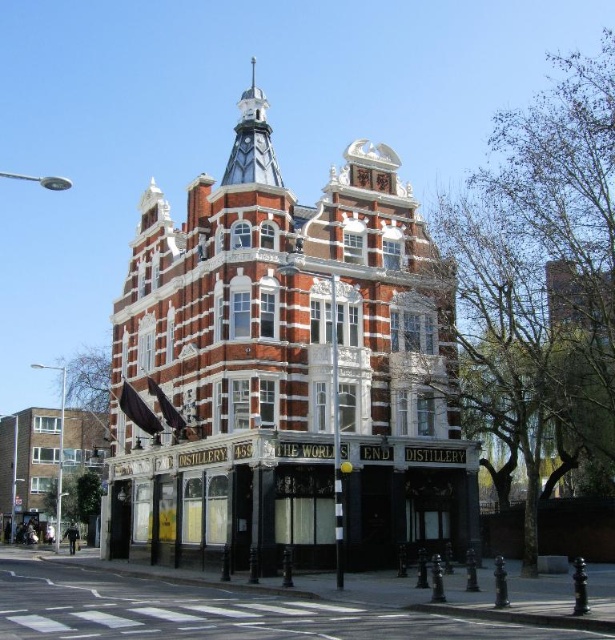
Question: Which object is closer to the camera taking this photo?

Choices:
 (A) red brick building at center
 (B) white brick building at lower left

Answer: (A)

Question: Is red brick building at center to the left of white brick building at lower left from the viewer's perspective?

Choices:
 (A) yes
 (B) no

Answer: (B)

Question: Which of the following is the farthest from the observer?

Choices:
 (A) (204, 508)
 (B) (68, 456)

Answer: (B)

Question: Does red brick building at center have a larger size compared to white brick building at lower left?

Choices:
 (A) no
 (B) yes

Answer: (B)

Question: Which point is farther to the camera?

Choices:
 (A) white brick building at lower left
 (B) red brick building at center

Answer: (A)

Question: Can you confirm if red brick building at center is wider than white brick building at lower left?

Choices:
 (A) no
 (B) yes

Answer: (B)